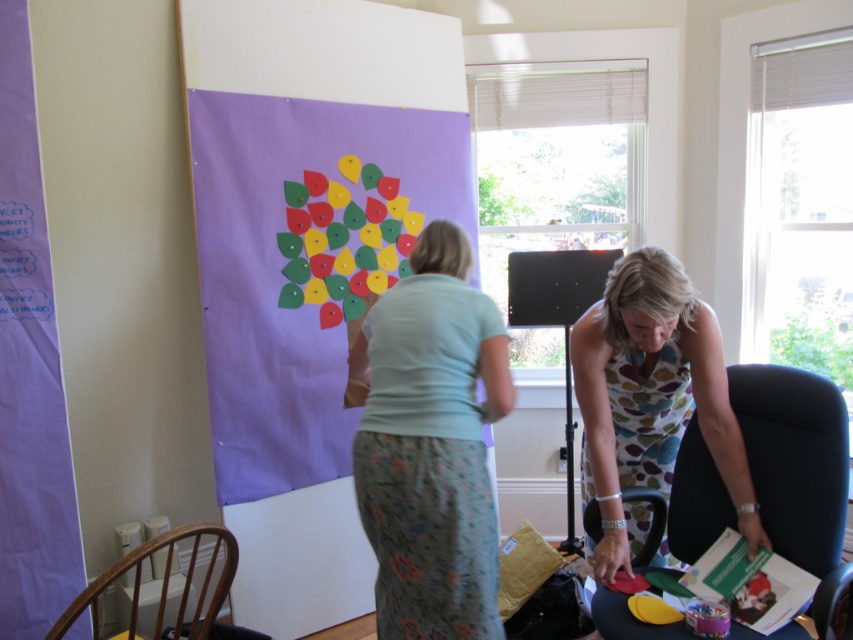
Who is more forward, (x=280, y=458) or (x=628, y=484)?

Point (x=628, y=484) is in front.

Who is taller, matte paper poster at center or floral dress at lower right?

Standing taller between the two is matte paper poster at center.

Does point (268, 492) lie behind point (708, 368)?

Yes.

This screenshot has height=640, width=853. I want to click on matte paper poster at center, so click(303, 262).

Does matte paper poster at center appear on the left side of matte plastic table at lower center?

Yes, matte paper poster at center is to the left of matte plastic table at lower center.

Between matte paper poster at center and matte plastic table at lower center, which one is positioned lower?

matte plastic table at lower center

Describe the element at coordinates (303, 262) in the screenshot. I see `matte paper poster at center` at that location.

At what (x,y) coordinates should I click in order to perform the action: click on matte paper poster at center. Please return your answer as a coordinate pair (x, y). Looking at the image, I should click on (303, 262).

Who is taller, light blue fabric shirt at center or matte plastic table at lower center?

light blue fabric shirt at center

Is light blue fabric shirt at center further to camera compared to matte plastic table at lower center?

No, light blue fabric shirt at center is closer to the viewer.

Which is behind, point (451, 516) or point (674, 625)?

The point (674, 625) is more distant.

Locate an element on the screen. The width and height of the screenshot is (853, 640). light blue fabric shirt at center is located at coordinates (430, 444).